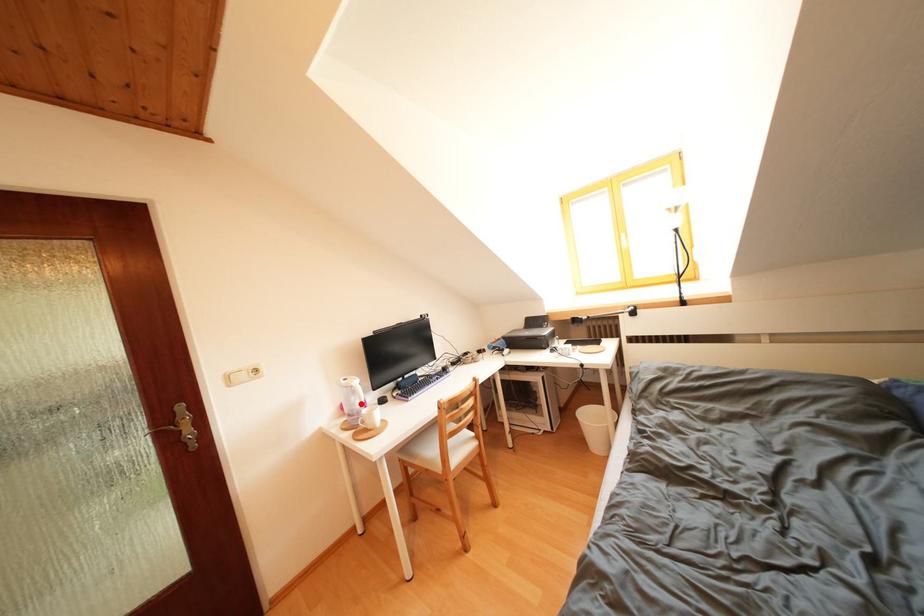
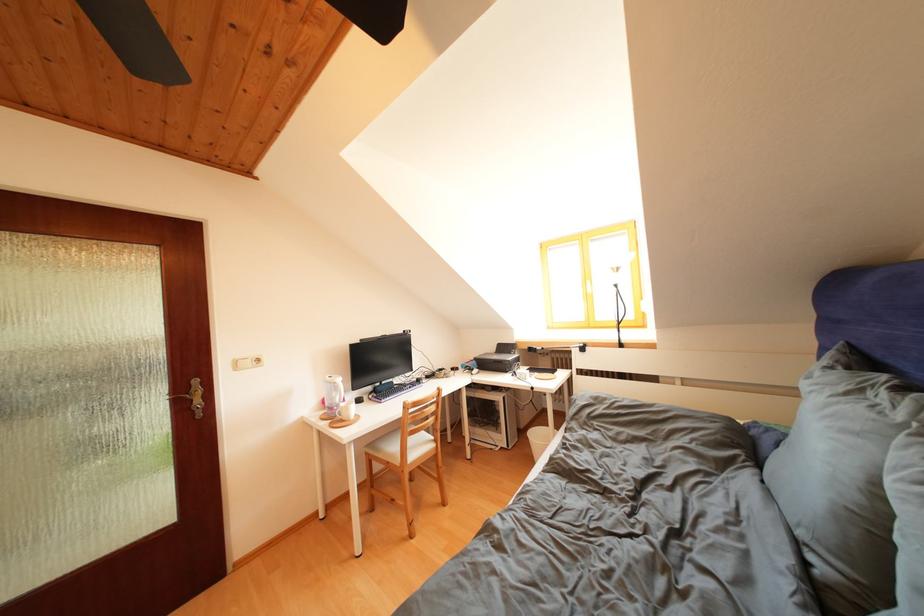
Find the pixel in the second image that matches the highlighted location in the first image.

(342, 399)